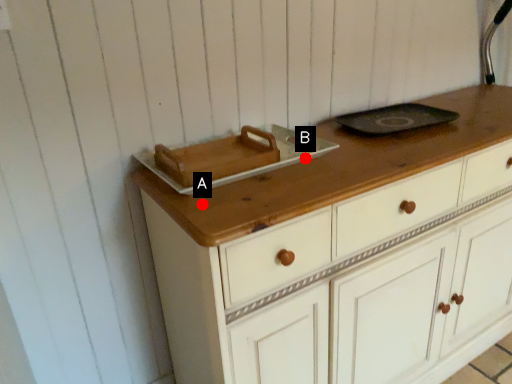
Question: Two points are circled on the image, labeled by A and B beside each circle. Which point is closer to the camera?

Choices:
 (A) A is closer
 (B) B is closer

Answer: (A)